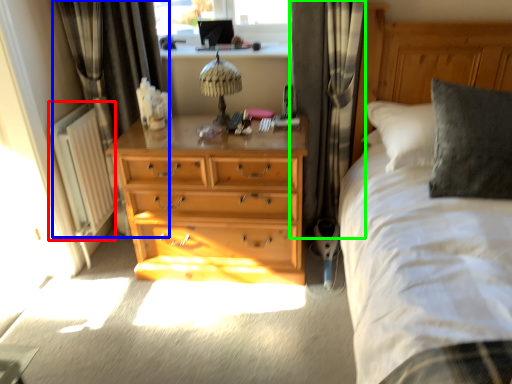
Question: Based on their relative distances, which object is farther from radiator (highlighted by a red box)? Choose from curtain (highlighted by a blue box) and curtain (highlighted by a green box).

Choices:
 (A) curtain
 (B) curtain

Answer: (B)